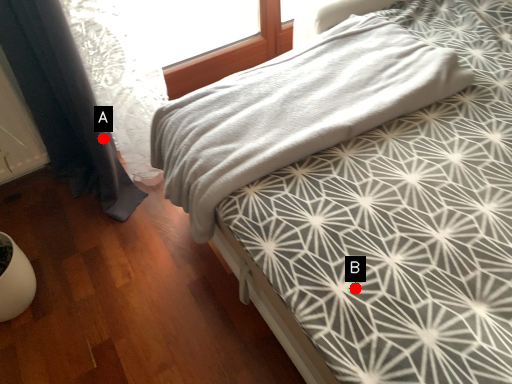
Question: Two points are circled on the image, labeled by A and B beside each circle. Among these points, which one is nearest to the camera?

Choices:
 (A) A is closer
 (B) B is closer

Answer: (B)